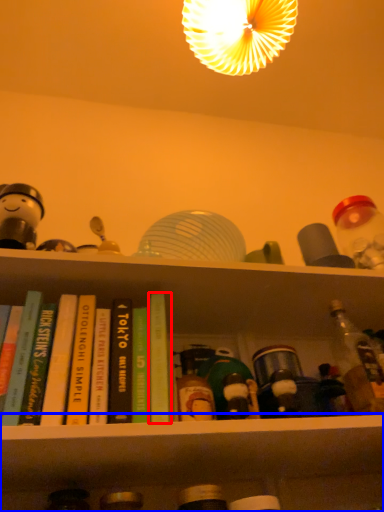
Question: Which object appears closest to the camera in this image, book (highlighted by a red box) or shelf (highlighted by a blue box)?

Choices:
 (A) book
 (B) shelf

Answer: (B)